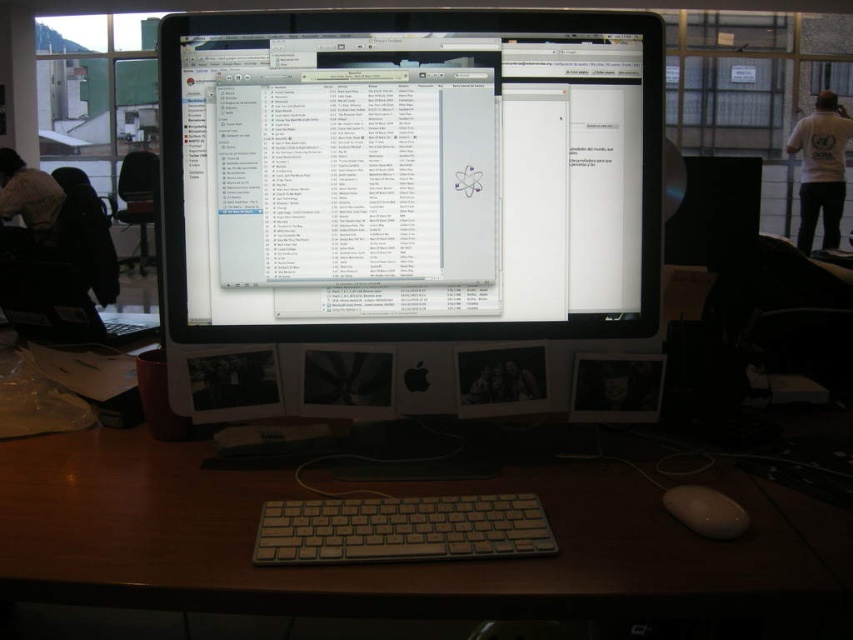
Question: Is satin black monitor at center to the right of white plastic keyboard at center from the viewer's perspective?

Choices:
 (A) yes
 (B) no

Answer: (A)

Question: Is satin black monitor at center further to camera compared to white matte mouse at lower right?

Choices:
 (A) yes
 (B) no

Answer: (A)

Question: Which object is closer to the camera taking this photo?

Choices:
 (A) white fabric shirt at left
 (B) satin black monitor at center

Answer: (B)

Question: Among these points, which one is nearest to the camera?

Choices:
 (A) (26, 180)
 (B) (618, 269)
 (C) (824, 227)

Answer: (B)

Question: Where is satin black monitor at center located in relation to white fabric shirt at left in the image?

Choices:
 (A) below
 (B) above

Answer: (A)

Question: Which object appears closest to the camera in this image?

Choices:
 (A) white fabric shirt at left
 (B) white plastic keyboard at center

Answer: (B)